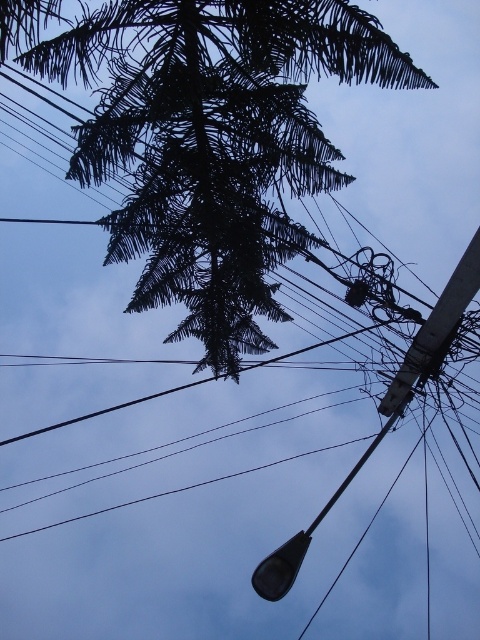
Does point (109, 170) come behind point (462, 259)?

That is True.

Where is `dark green textured tree at upper center`? dark green textured tree at upper center is located at coordinates (207, 138).